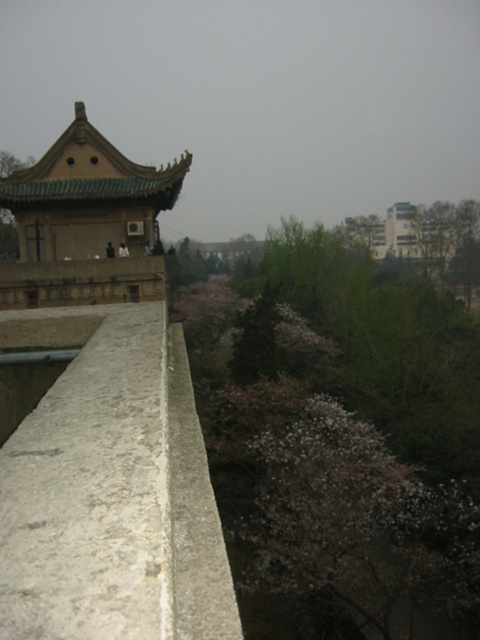
Is bare branches at center positioned in front of green glazed tile temple at upper left?

Yes, it is in front of green glazed tile temple at upper left.

Who is positioned more to the right, bare branches at center or green glazed tile temple at upper left?

From the viewer's perspective, bare branches at center appears more on the right side.

Is point (381, 557) closer to viewer compared to point (118, 177)?

Yes, it is.

At what (x,y) coordinates should I click in order to perform the action: click on bare branches at center. Please return your answer as a coordinate pair (x, y). Looking at the image, I should click on (339, 440).